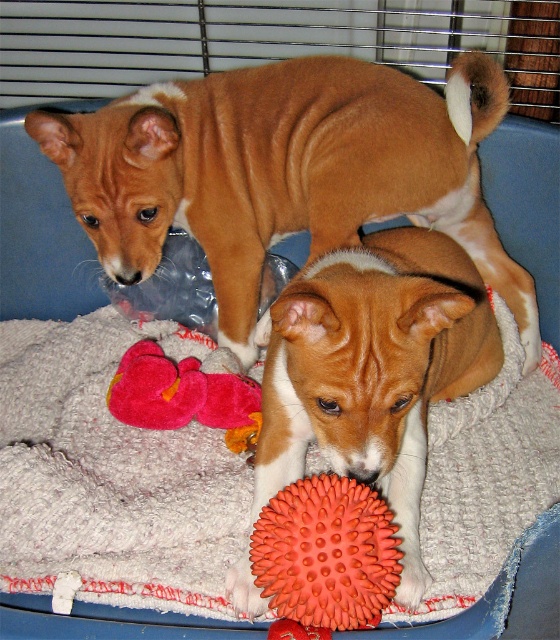
Is point (67, 547) more distant than point (376, 520)?

That is True.

Measure the distance between white textured dog bed at center and orange spiky ball at center.

A distance of 30.22 centimeters exists between white textured dog bed at center and orange spiky ball at center.

Who is more forward, (109, 541) or (312, 513)?

Point (312, 513)

Locate an element on the screen. white textured dog bed at center is located at coordinates (109, 476).

Does orange spiky ball at center appear on the right side of fuzzy pink plush at lower left?

Yes, orange spiky ball at center is to the right of fuzzy pink plush at lower left.

Is point (296, 618) closer to viewer compared to point (172, 397)?

Yes, it is.

Locate an element on the screen. The width and height of the screenshot is (560, 640). orange spiky ball at center is located at coordinates (326, 552).

Is brown matte dog at center to the left of fuzzy pink plush at lower left from the viewer's perspective?

Incorrect, brown matte dog at center is not on the left side of fuzzy pink plush at lower left.

Is point (476, 342) farther from camera compared to point (161, 406)?

Yes, it is.

Which is in front, point (413, 268) or point (138, 396)?

Positioned in front is point (413, 268).

The width and height of the screenshot is (560, 640). In order to click on brown matte dog at center in this screenshot , I will do `click(374, 369)`.